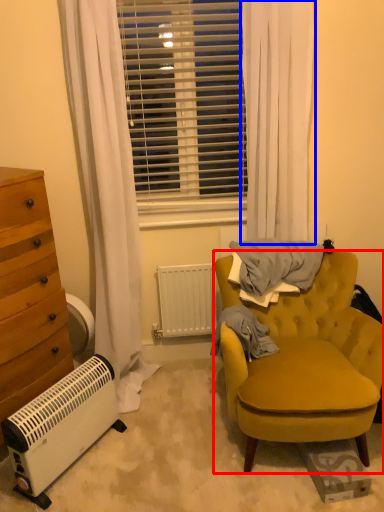
Question: Which object is further to the camera taking this photo, chair (highlighted by a red box) or curtain (highlighted by a blue box)?

Choices:
 (A) chair
 (B) curtain

Answer: (B)